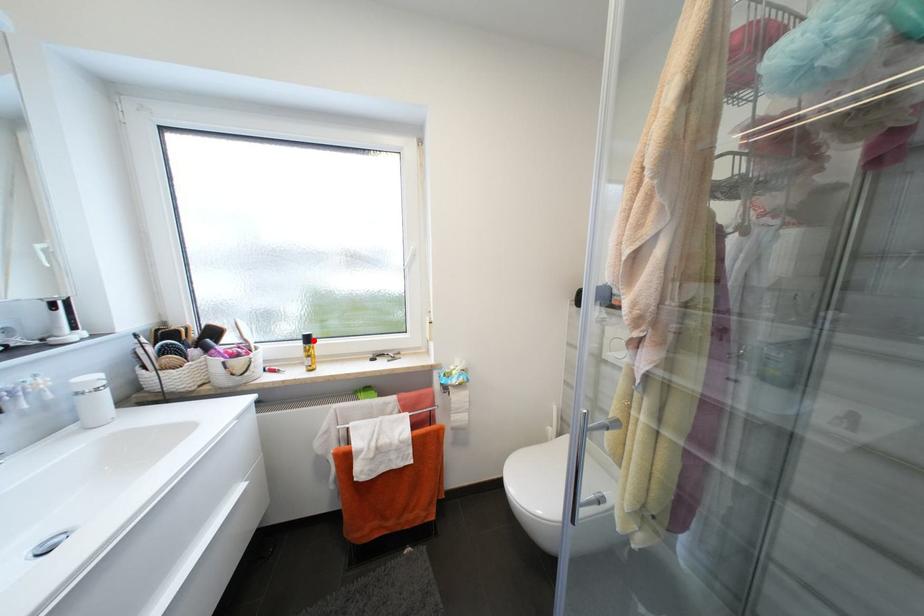
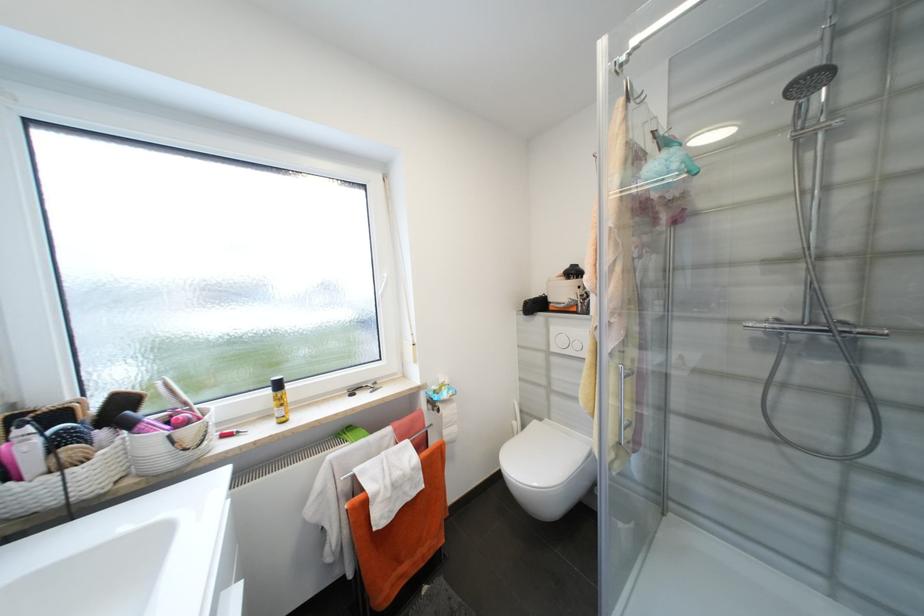
The point at the highlighted location is marked in the first image. Where is the corresponding point in the second image?

(284, 386)